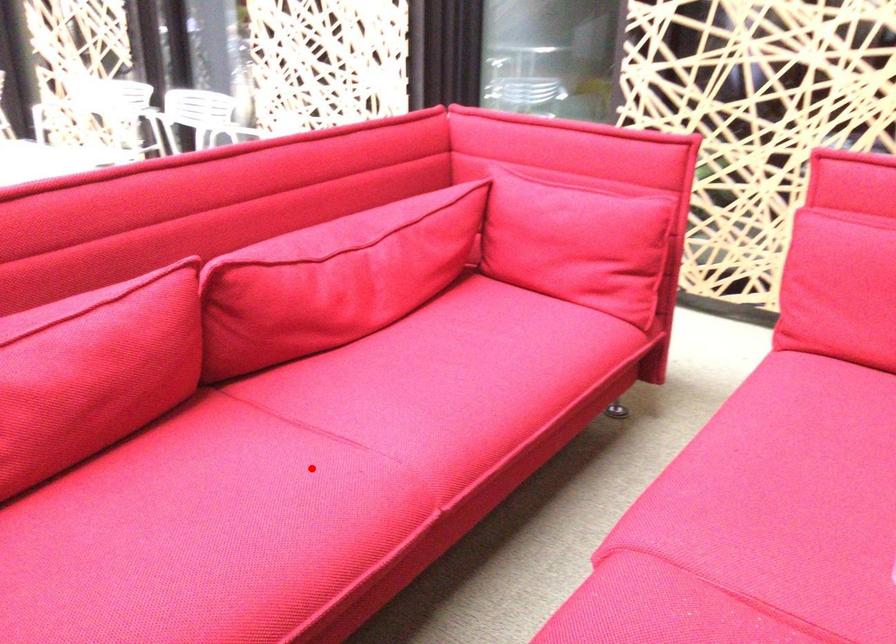
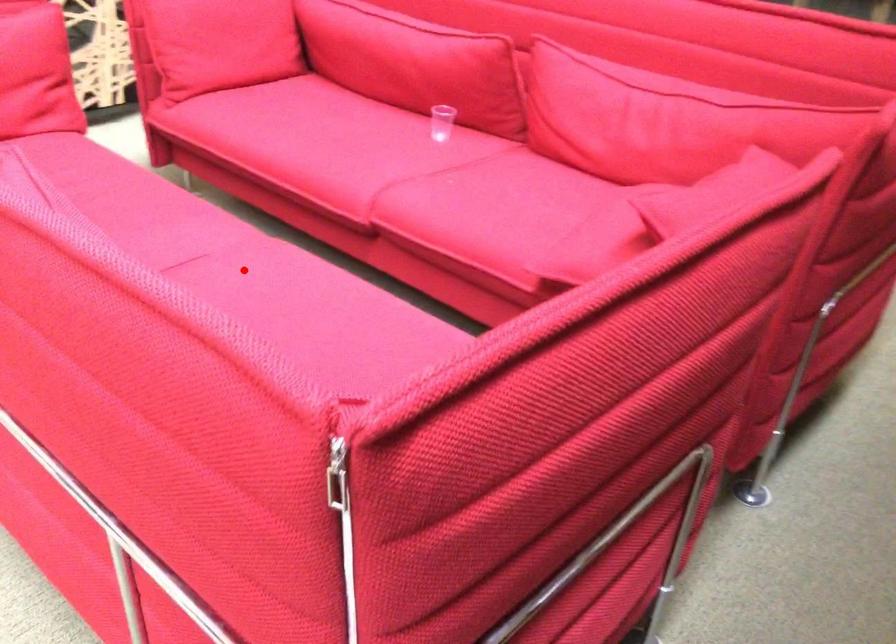
I am providing you with two images of the same scene from different viewpoints. A red point is marked on the first image and another point is marked on the second image. Does the point marked in image1 correspond to the same location as the one in image2?

Yes